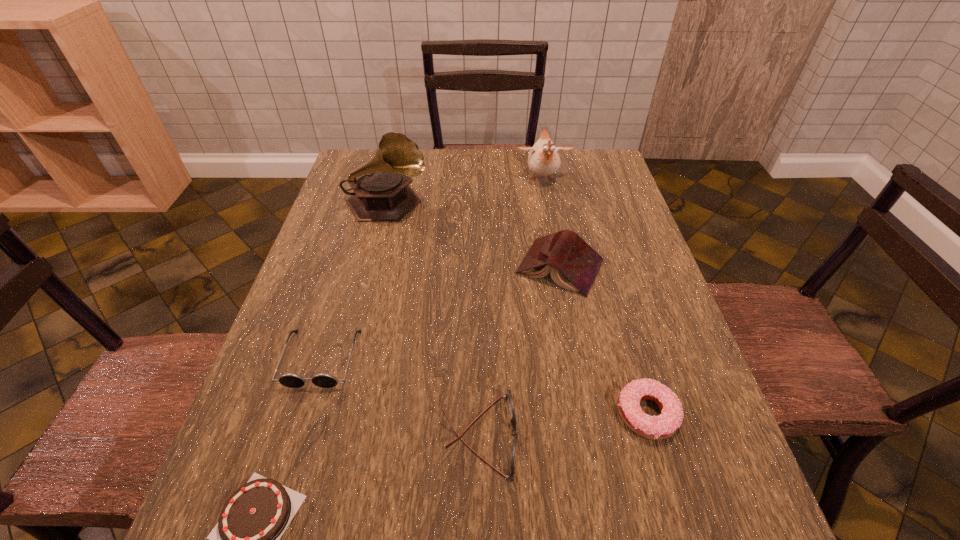
The height and width of the screenshot is (540, 960). I want to click on blank region between the doughnut and the phonograph record, so pyautogui.click(x=516, y=310).

Locate an element on the screen. This screenshot has height=540, width=960. unoccupied area between the sixth shortest object and the book is located at coordinates (551, 224).

This screenshot has height=540, width=960. Identify the location of vacant area between the tallest object and the sunglasses. (354, 282).

The height and width of the screenshot is (540, 960). In order to click on object that is the third nearest to the fourth object from right to left in this screenshot , I will do `click(246, 538)`.

You are a GUI agent. You are given a task and a screenshot of the screen. Output one action in this format:
    pyautogui.click(x=<x>, y=<y>)
    Task: Click on the fifth closest object to the fifth shortest object
    
    Given the screenshot: What is the action you would take?
    pyautogui.click(x=291, y=380)

Where is `free space that satisfies the following two spatial constraints: 1. on the horn direction of the tallest object; 2. on the front-facing side of the sunglasses`? This screenshot has height=540, width=960. free space that satisfies the following two spatial constraints: 1. on the horn direction of the tallest object; 2. on the front-facing side of the sunglasses is located at coordinates (349, 359).